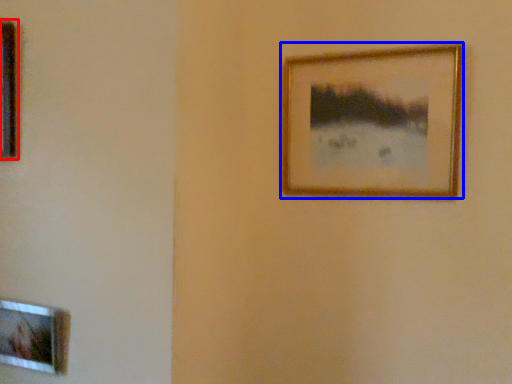
Question: Among these objects, which one is farthest to the camera, picture frame (highlighted by a red box) or picture frame (highlighted by a blue box)?

Choices:
 (A) picture frame
 (B) picture frame

Answer: (B)